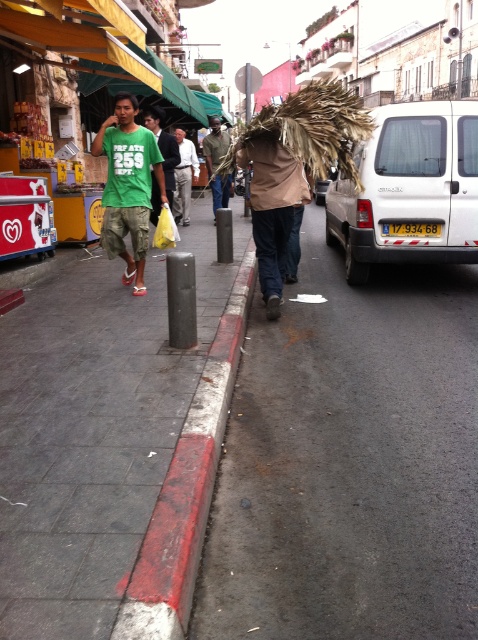
Which is below, red asphalt pavement at lower center or red painted concrete curb at lower center?

Positioned lower is red asphalt pavement at lower center.

Is point (471, 381) farther from camera compared to point (169, 486)?

Yes.

You are a GUI agent. You are given a task and a screenshot of the screen. Output one action in this format:
    pyautogui.click(x=<x>, y=<y>)
    Task: Click on the red asphalt pavement at lower center
    This screenshot has width=478, height=640.
    Given the screenshot: What is the action you would take?
    pyautogui.click(x=349, y=461)

Does red asphalt pavement at lower center lie behind green matte t-shirt at left?

No, red asphalt pavement at lower center is in front of green matte t-shirt at left.

Locate an element on the screen. The width and height of the screenshot is (478, 640). red asphalt pavement at lower center is located at coordinates (349, 461).

In the scene shown: Is brown woven basket at center to the right of yellow plastic license plate at center from the viewer's perspective?

No, brown woven basket at center is not to the right of yellow plastic license plate at center.

Describe the element at coordinates (217, 163) in the screenshot. Image resolution: width=478 pixels, height=640 pixels. I see `brown woven basket at center` at that location.

Does point (214, 179) come closer to viewer compared to point (432, 234)?

No, (214, 179) is further to viewer.

Locate an element on the screen. brown woven basket at center is located at coordinates (217, 163).